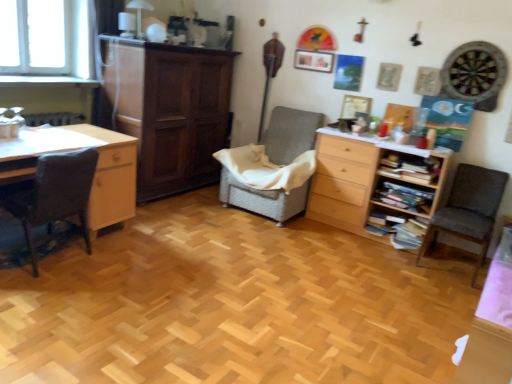
Find the location of a particular element. vacant region to the right of light wood desk at left is located at coordinates pyautogui.click(x=155, y=254).